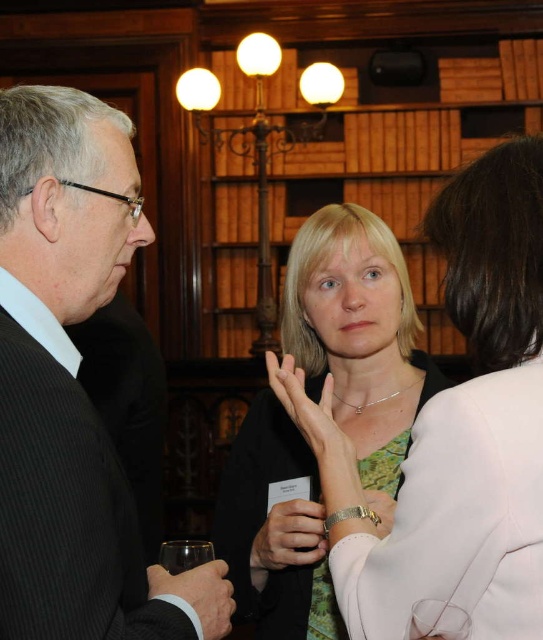
Is black textured suit at left shorter than white leather jacket at center?

No.

Who is lower down, black textured suit at left or white leather jacket at center?

white leather jacket at center

The height and width of the screenshot is (640, 543). I want to click on black textured suit at left, so click(x=72, y=387).

Which is more to the left, matte green dress at center or transparent glass at lower left?

transparent glass at lower left

Which is below, matte green dress at center or transparent glass at lower left?

transparent glass at lower left is lower down.

Which is in front, point (301, 234) or point (205, 548)?

Positioned in front is point (205, 548).

You are a GUI agent. You are given a task and a screenshot of the screen. Output one action in this format:
    pyautogui.click(x=<x>, y=<y>)
    Task: Click on the matte green dress at center
    
    Given the screenshot: What is the action you would take?
    pyautogui.click(x=358, y=336)

Is white leather jacket at center taller than transparent glass at lower left?

Yes, white leather jacket at center is taller than transparent glass at lower left.

What do you see at coordinates (458, 516) in the screenshot? The width and height of the screenshot is (543, 640). I see `white leather jacket at center` at bounding box center [458, 516].

This screenshot has width=543, height=640. I want to click on white leather jacket at center, so click(x=458, y=516).